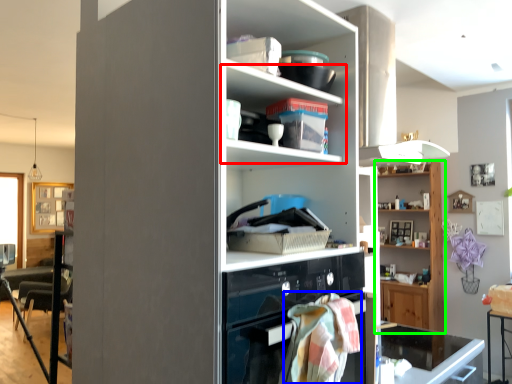
Question: Estimate the real-world distances between objects in this image. Which object is closer to shelf (highlighted by a red box), blanket (highlighted by a blue box) or shelf (highlighted by a green box)?

Choices:
 (A) blanket
 (B) shelf

Answer: (A)